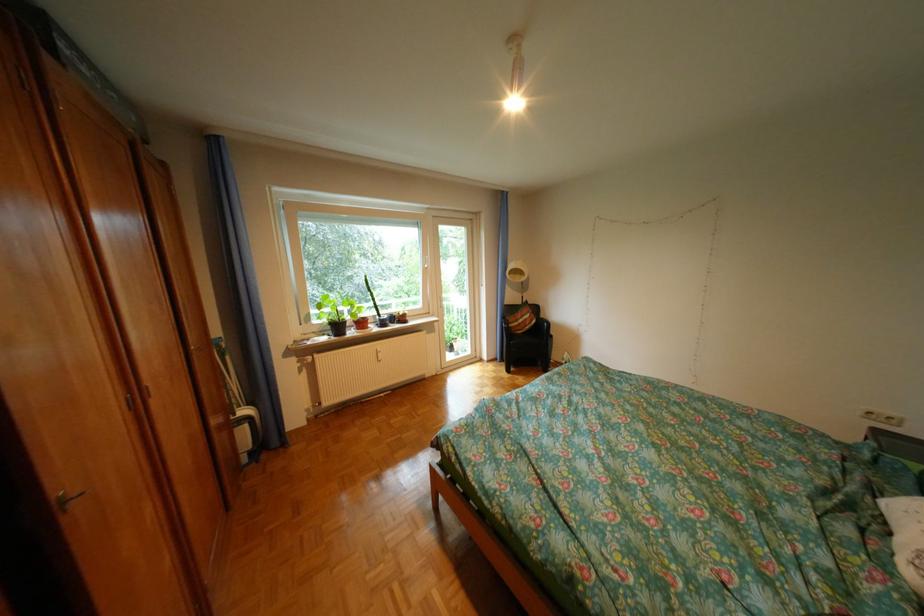
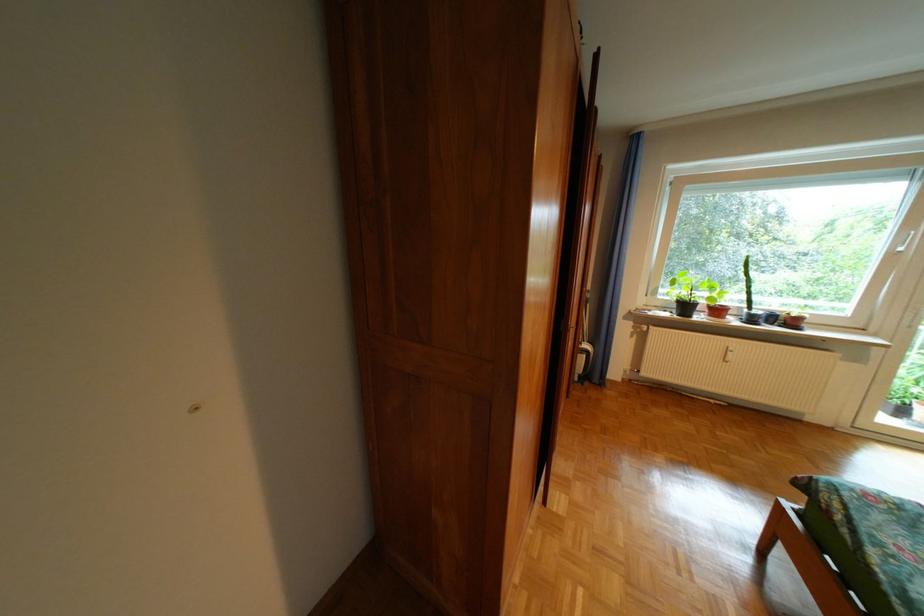
In the second image, find the point that corresponds to (x=338, y=339) in the first image.

(679, 315)